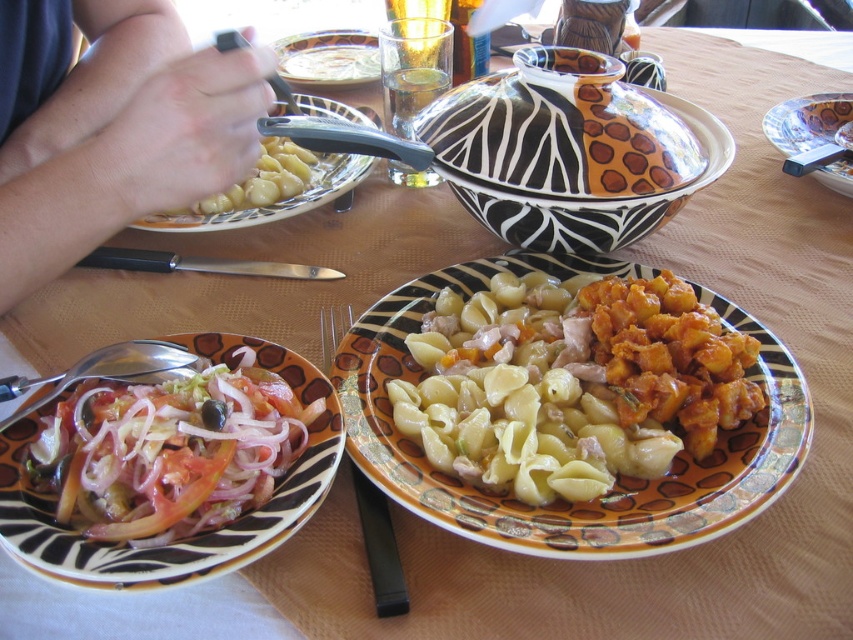
Question: Which point is farther to the camera?

Choices:
 (A) (329, 163)
 (B) (480, 209)
 (C) (367, 61)
 (D) (299, 468)

Answer: (C)

Question: Considering the real-world distances, which object is farthest from the matte ceramic plate at upper left?

Choices:
 (A) matte ceramic bowl at upper center
 (B) matte black hand at upper left
 (C) zebra-patterned ceramic bowl at center

Answer: (A)

Question: Is matte black hand at upper left closer to camera compared to matte ceramic plate at upper left?

Choices:
 (A) yes
 (B) no

Answer: (A)

Question: Does matte ceramic plate at center appear on the right side of zebra-patterned ceramic bowl at center?

Choices:
 (A) no
 (B) yes

Answer: (A)

Question: Among these points, which one is nearest to the camera?

Choices:
 (A) (631, 200)
 (B) (386, 550)
 (C) (431, 516)
 (D) (282, 45)

Answer: (C)

Question: Does matte ceramic plate at center lie in front of matte ceramic bowl at upper center?

Choices:
 (A) yes
 (B) no

Answer: (A)